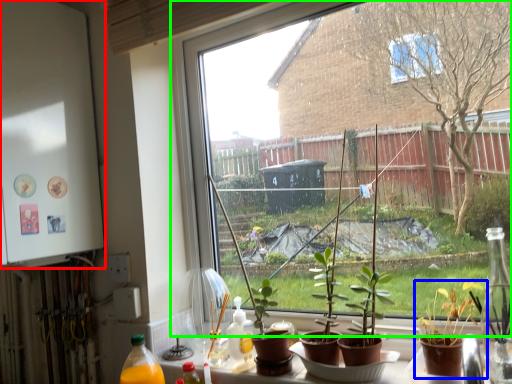
Question: Based on their relative distances, which object is nearer to back (highlighted by a red box)? Choose from houseplant (highlighted by a blue box) and window (highlighted by a green box).

Choices:
 (A) houseplant
 (B) window

Answer: (B)